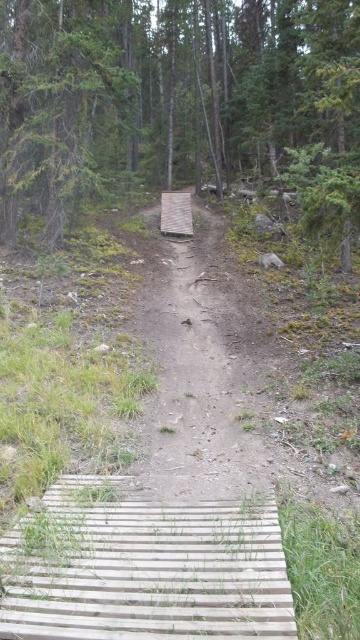
Question: Does green matte tree at upper center have a larger size compared to green matte tree at upper left?

Choices:
 (A) no
 (B) yes

Answer: (B)

Question: Where is green matte tree at upper left located in relation to wooden plank at center in the image?

Choices:
 (A) below
 (B) above

Answer: (B)

Question: Which point is closer to the camera taking this photo?

Choices:
 (A) (0, 54)
 (B) (163, 214)

Answer: (A)

Question: Can you confirm if green matte tree at upper center is wider than green matte tree at upper left?

Choices:
 (A) yes
 (B) no

Answer: (A)

Question: Considering the real-world distances, which object is closest to the wooden plank at center?

Choices:
 (A) green matte tree at upper center
 (B) green matte tree at upper left

Answer: (B)

Question: Which of the following is the farthest from the observer?

Choices:
 (A) wooden plank at center
 (B) green matte tree at upper left

Answer: (A)